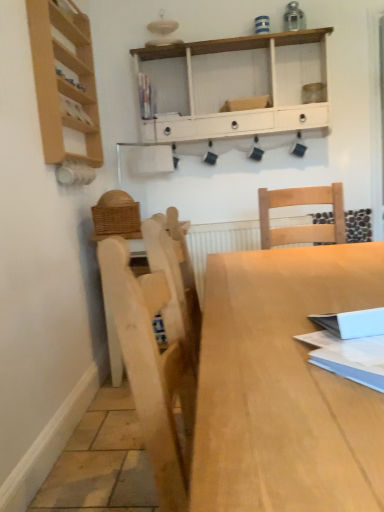
What do you see at coordinates (145, 97) in the screenshot? This screenshot has width=384, height=512. I see `matte plastic book at upper center, marked as the 1th book in a back-to-front arrangement` at bounding box center [145, 97].

Where is `light wood table at center`? Image resolution: width=384 pixels, height=512 pixels. light wood table at center is located at coordinates (284, 386).

Image resolution: width=384 pixels, height=512 pixels. What do you see at coordinates (238, 112) in the screenshot?
I see `white painted wood shelf at upper center, which is the first shelf in right-to-left order` at bounding box center [238, 112].

Find the location of `white paper book at right, placed as the first book when sorted from right to left`. white paper book at right, placed as the first book when sorted from right to left is located at coordinates (350, 345).

What do you see at coordinates (350, 345) in the screenshot? I see `white paper book at right, the second book when ordered from left to right` at bounding box center [350, 345].

Describe the element at coordinates (64, 80) in the screenshot. This screenshot has width=384, height=512. I see `light wood shelf at left, which is the second shelf from back to front` at that location.

Where is `matte plastic book at upper center, marked as the 1th book in a back-to-front arrangement`? The image size is (384, 512). matte plastic book at upper center, marked as the 1th book in a back-to-front arrangement is located at coordinates (145, 97).

Visually, is matte plastic book at upper center, which is the second book from front to back, positioned to the left or to the right of white paper book at right, the 1th book from the bottom?

matte plastic book at upper center, which is the second book from front to back, is positioned on white paper book at right, the 1th book from the bottom,'s left side.

Considering the sizes of matte plastic book at upper center, marked as the 1th book in a back-to-front arrangement, and white paper book at right, the 2th book positioned from the top, in the image, is matte plastic book at upper center, marked as the 1th book in a back-to-front arrangement, bigger or smaller than white paper book at right, the 2th book positioned from the top,?

matte plastic book at upper center, marked as the 1th book in a back-to-front arrangement, is smaller than white paper book at right, the 2th book positioned from the top.

Is white paper book at right, which is counted as the first book, starting from the front, located within matte plastic book at upper center, which is counted as the second book, starting from the right?

No, white paper book at right, which is counted as the first book, starting from the front, is not a part of matte plastic book at upper center, which is counted as the second book, starting from the right.

Considering the points (63, 48) and (150, 106), which point is in front, point (63, 48) or point (150, 106)?

The point (63, 48) is closer to the camera.

From the picture: Is the depth of light wood shelf at left, the second shelf positioned from the right, greater than that of matte plastic book at upper center, which is counted as the second book, starting from the right?

That is False.

Which is more to the left, light wood shelf at left, the second shelf positioned from the right, or matte plastic book at upper center, which is counted as the second book, starting from the right?

Positioned to the left is light wood shelf at left, the second shelf positioned from the right.

Based on the photo, from the image's perspective, is light wood shelf at left, the second shelf positioned from the right, positioned above or below matte plastic book at upper center, which is counted as the second book, starting from the right?

Clearly, from the image's perspective, light wood shelf at left, the second shelf positioned from the right, is below matte plastic book at upper center, which is counted as the second book, starting from the right.

Is white paper book at right, the 1th book from the bottom, thinner than matte plastic book at upper center, which is the 2th book from bottom to top?

No.

From a real-world perspective, between white paper book at right, which is counted as the first book, starting from the front, and matte plastic book at upper center, which is counted as the second book, starting from the right, who is vertically lower?

In real-world perspective, white paper book at right, which is counted as the first book, starting from the front, is lower.

Is white paper book at right, placed as the 2th book when sorted from back to front, turned away from matte plastic book at upper center, which is the 2th book from bottom to top?

white paper book at right, placed as the 2th book when sorted from back to front, does not have its back to matte plastic book at upper center, which is the 2th book from bottom to top.

From the picture: Is the surface of white paper book at right, which is counted as the first book, starting from the front, in direct contact with matte plastic book at upper center, marked as the 1th book in a back-to-front arrangement?

white paper book at right, which is counted as the first book, starting from the front, is not next to matte plastic book at upper center, marked as the 1th book in a back-to-front arrangement, and they're not touching.

Can you confirm if white painted wood shelf at upper center, which is the first shelf in right-to-left order, is positioned to the right of light wood table at center?

No, white painted wood shelf at upper center, which is the first shelf in right-to-left order, is not to the right of light wood table at center.

Can you confirm if white painted wood shelf at upper center, marked as the second shelf in a front-to-back arrangement, is thinner than light wood table at center?

Yes.

Is white painted wood shelf at upper center, which is the first shelf from back to front, surrounding light wood table at center?

No, light wood table at center is located outside of white painted wood shelf at upper center, which is the first shelf from back to front.

Which object is positioned more to the right, light wood shelf at left, the second shelf positioned from the right, or light wood table at center?

light wood table at center.

Is light wood shelf at left, arranged as the first shelf when viewed from the front, bigger than light wood table at center?

No.

Does light wood shelf at left, which is the second shelf from back to front, have a lesser width compared to light wood table at center?

Correct, the width of light wood shelf at left, which is the second shelf from back to front, is less than that of light wood table at center.

Considering the relative sizes of matte plastic book at upper center, arranged as the 1th book when viewed from the top, and light wood table at center in the image provided, is matte plastic book at upper center, arranged as the 1th book when viewed from the top, smaller than light wood table at center?

Correct, matte plastic book at upper center, arranged as the 1th book when viewed from the top, occupies less space than light wood table at center.

Which of these two, matte plastic book at upper center, arranged as the 1th book when viewed from the top, or light wood table at center, is wider?

light wood table at center.

Relative to light wood table at center, is matte plastic book at upper center, which is the 2th book from bottom to top, in front or behind?

matte plastic book at upper center, which is the 2th book from bottom to top, is positioned farther from the viewer than light wood table at center.

Is light wood table at center behind white painted wood shelf at upper center, which is the 2th shelf from left to right?

No.

How far apart are light wood table at center and white painted wood shelf at upper center, which is the first shelf from back to front?

6.01 feet.

Based on the photo, does light wood table at center have a lesser width compared to white painted wood shelf at upper center, which is the first shelf in right-to-left order?

No.

How many degrees apart are the facing directions of light wood table at center and white painted wood shelf at upper center, which is the first shelf in right-to-left order?

The facing directions of light wood table at center and white painted wood shelf at upper center, which is the first shelf in right-to-left order, are 90.8 degrees apart.

You are a GUI agent. You are given a task and a screenshot of the screen. Output one action in this format:
    pyautogui.click(x=<x>, y=<y>)
    Task: Click on the book above the white paper book at right, the second book when ordered from left to right (from the image's perspective)
    Image resolution: width=384 pixels, height=512 pixels.
    Given the screenshot: What is the action you would take?
    pyautogui.click(x=145, y=97)

At what (x,y) coordinates should I click in order to perform the action: click on shelf above the matte plastic book at upper center, which is the second book from front to back (from a real-world perspective). Please return your answer as a coordinate pair (x, y). Looking at the image, I should click on (64, 80).

When comparing their distances from matte plastic book at upper center, the 1th book when ordered from left to right, does white painted wood shelf at upper center, which is the first shelf from back to front, or white paper book at right, the second book when ordered from left to right, seem further?

white paper book at right, the second book when ordered from left to right, is positioned further to the anchor matte plastic book at upper center, the 1th book when ordered from left to right.

Looking at the image, which one is located further to white painted wood shelf at upper center, which is the 2th shelf from left to right, light wood table at center or white paper book at right, which is counted as the first book, starting from the front?

white paper book at right, which is counted as the first book, starting from the front, lies further to white painted wood shelf at upper center, which is the 2th shelf from left to right, than the other object.

Which object lies nearer to the anchor point matte plastic book at upper center, which is the second book from front to back, white painted wood shelf at upper center, which is the first shelf in right-to-left order, or light wood shelf at left, which appears as the first shelf when viewed from the left?

white painted wood shelf at upper center, which is the first shelf in right-to-left order, is positioned closer to the anchor matte plastic book at upper center, which is the second book from front to back.

Based on their spatial positions, is light wood table at center or light wood shelf at left, which is the second shelf from back to front, further from white paper book at right, which is counted as the first book, starting from the front?

light wood shelf at left, which is the second shelf from back to front, is positioned further to the anchor white paper book at right, which is counted as the first book, starting from the front.

When comparing their distances from white paper book at right, placed as the first book when sorted from right to left, does light wood shelf at left, the second shelf positioned from the right, or light wood table at center seem closer?

light wood table at center lies closer to white paper book at right, placed as the first book when sorted from right to left, than the other object.

Estimate the real-world distances between objects in this image. Which object is further from light wood shelf at left, the second shelf positioned from the right, white painted wood shelf at upper center, marked as the second shelf in a front-to-back arrangement, or white paper book at right, the second book when ordered from left to right?

white paper book at right, the second book when ordered from left to right, is positioned further to the anchor light wood shelf at left, the second shelf positioned from the right.

Estimate the real-world distances between objects in this image. Which object is further from matte plastic book at upper center, arranged as the 1th book when viewed from the top, light wood shelf at left, which is the second shelf from back to front, or white painted wood shelf at upper center, which is the first shelf from back to front?

Among the two, light wood shelf at left, which is the second shelf from back to front, is located further to matte plastic book at upper center, arranged as the 1th book when viewed from the top.

Looking at the image, which one is located further to white paper book at right, the 2th book positioned from the top, white painted wood shelf at upper center, marked as the second shelf in a front-to-back arrangement, or light wood table at center?

The object further to white paper book at right, the 2th book positioned from the top, is white painted wood shelf at upper center, marked as the second shelf in a front-to-back arrangement.

Locate an element on the screen. The image size is (384, 512). book situated between light wood shelf at left, the second shelf positioned from the right, and white painted wood shelf at upper center, which is the 2th shelf from left to right, from left to right is located at coordinates (145, 97).

Locate an element on the screen. Image resolution: width=384 pixels, height=512 pixels. book positioned between light wood table at center and matte plastic book at upper center, arranged as the 1th book when viewed from the top, from near to far is located at coordinates (350, 345).

Identify the location of shelf between white paper book at right, the second book when ordered from left to right, and white painted wood shelf at upper center, which is the first shelf in right-to-left order, in the front-back direction. Image resolution: width=384 pixels, height=512 pixels. (64, 80).

Identify the location of shelf between light wood table at center and white painted wood shelf at upper center, which is the first shelf from back to front, along the z-axis. (64, 80).